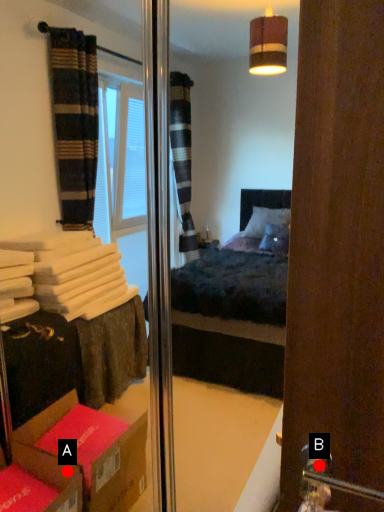
Question: Two points are circled on the image, labeled by A and B beside each circle. Which point is farther to the camera?

Choices:
 (A) A is further
 (B) B is further

Answer: (A)